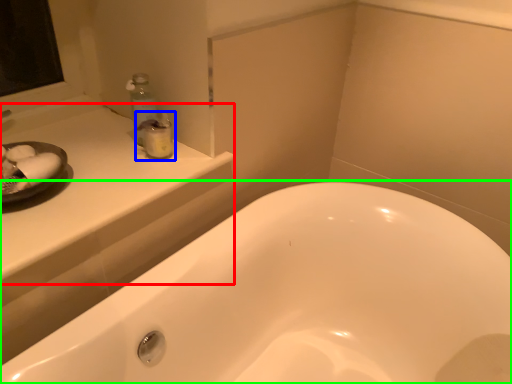
Question: Considering the real-world distances, which object is closest to counter top (highlighted by a red box)? toiletry (highlighted by a blue box) or bathtub (highlighted by a green box).

Choices:
 (A) toiletry
 (B) bathtub

Answer: (A)